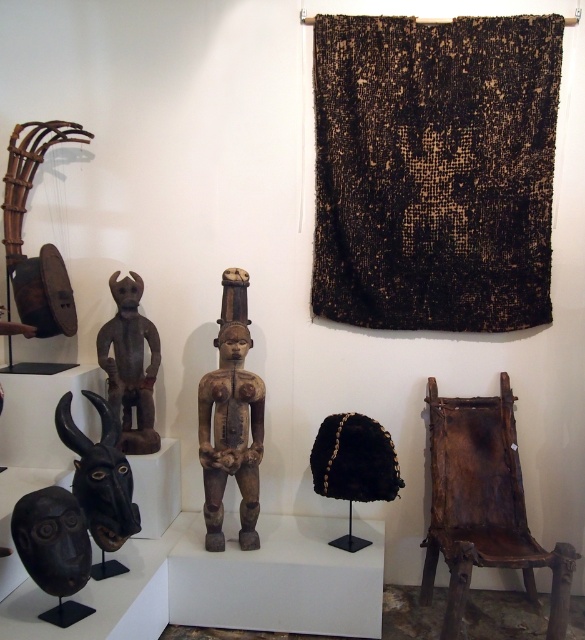
Can you confirm if brown wooden figure at center is thinner than brown wooden figure at left?

No.

Can you confirm if brown wooden figure at center is wider than brown wooden figure at left?

Correct, the width of brown wooden figure at center exceeds that of brown wooden figure at left.

Who is more forward, (208, 500) or (142, 429)?

Point (208, 500)

I want to click on brown wooden figure at center, so click(x=232, y=419).

Which is above, brown leather chair at lower right or brown wooden figure at center?

Positioned higher is brown wooden figure at center.

Measure the distance between brown leather chair at lower right and brown wooden figure at center.

36.51 inches

At what (x,y) coordinates should I click in order to perform the action: click on brown leather chair at lower right. Please return your answer as a coordinate pair (x, y). The width and height of the screenshot is (585, 640). Looking at the image, I should click on [x=483, y=506].

The height and width of the screenshot is (640, 585). I want to click on brown leather chair at lower right, so click(x=483, y=506).

Can you confirm if black woven cloth at upper center is shorter than brown wooden figure at center?

No, black woven cloth at upper center is not shorter than brown wooden figure at center.

Consider the image. Can you confirm if black woven cloth at upper center is wider than brown wooden figure at center?

Yes.

Find the location of a particular element. The width and height of the screenshot is (585, 640). black woven cloth at upper center is located at coordinates (435, 170).